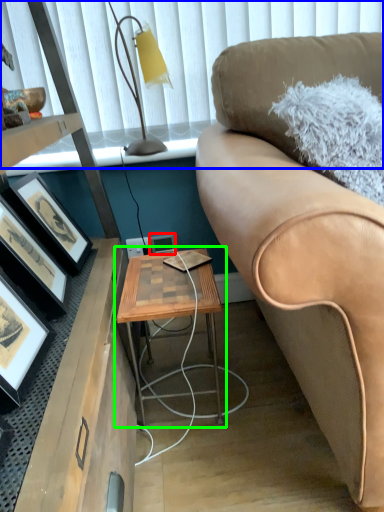
Question: Which object is the closest to the picture frame (highlighted by a red box)? Choose among these: window screen (highlighted by a blue box) or table (highlighted by a green box).

Choices:
 (A) window screen
 (B) table

Answer: (B)